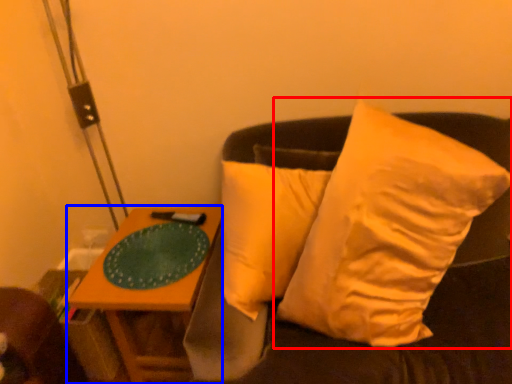
Question: Which object appears farthest to the camera in this image, pillow (highlighted by a red box) or table (highlighted by a blue box)?

Choices:
 (A) pillow
 (B) table

Answer: (B)